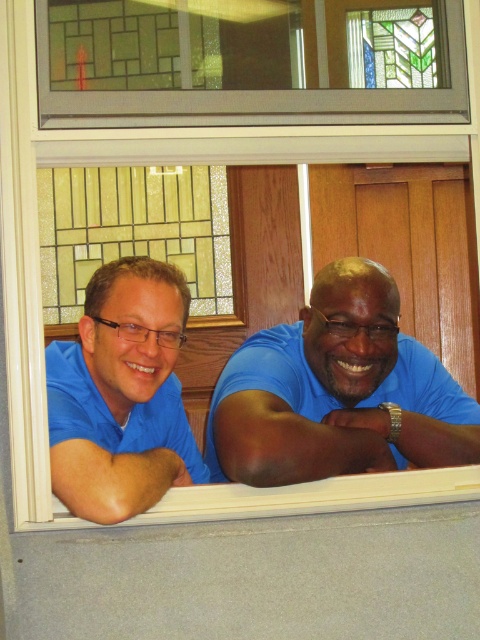
Question: Does blue matte shirt at center appear under blue smooth shirt at lower right?

Choices:
 (A) no
 (B) yes

Answer: (A)

Question: Which of the following is the farthest from the observer?

Choices:
 (A) blue matte shirt at left
 (B) stained glass window at upper center
 (C) blue smooth shirt at lower right
 (D) matte blue arm at lower left

Answer: (B)

Question: Which of the following is the closest to the observer?

Choices:
 (A) blue matte shirt at center
 (B) stained glass window at upper center
 (C) white wood window sill at lower center

Answer: (C)

Question: Can you confirm if blue matte shirt at center is thinner than matte blue arm at lower left?

Choices:
 (A) yes
 (B) no

Answer: (B)

Question: Which object appears closest to the camera in this image?

Choices:
 (A) white wood window sill at lower center
 (B) blue matte shirt at left
 (C) matte blue arm at lower left
 (D) blue smooth shirt at lower right

Answer: (C)

Question: Does blue matte shirt at left appear over white wood window sill at lower center?

Choices:
 (A) no
 (B) yes

Answer: (B)